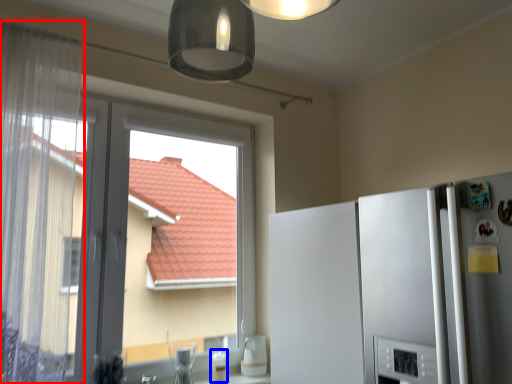
Question: Which point is closer to the camera, curtain (highlighted by a red box) or appliance (highlighted by a blue box)?

Choices:
 (A) curtain
 (B) appliance

Answer: (A)